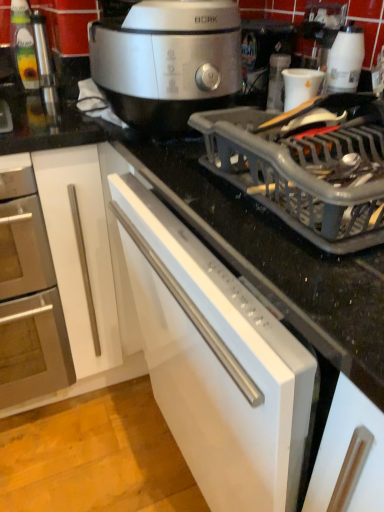
Question: From the image's perspective, would you say white glossy cup at upper right is positioned over satin silver slow cooker at upper center?

Choices:
 (A) no
 (B) yes

Answer: (A)

Question: Is white glossy cup at upper right oriented away from satin silver slow cooker at upper center?

Choices:
 (A) yes
 (B) no

Answer: (B)

Question: Does white glossy cup at upper right have a greater height compared to satin silver slow cooker at upper center?

Choices:
 (A) yes
 (B) no

Answer: (B)

Question: Can you confirm if white glossy cup at upper right is wider than satin silver slow cooker at upper center?

Choices:
 (A) no
 (B) yes

Answer: (A)

Question: From the image's perspective, does white glossy cup at upper right appear lower than satin silver slow cooker at upper center?

Choices:
 (A) no
 (B) yes

Answer: (B)

Question: In terms of width, does brushed metal oven at left look wider or thinner when compared to white matte dishwasher at center?

Choices:
 (A) wide
 (B) thin

Answer: (A)

Question: From a real-world perspective, relative to white matte dishwasher at center, is brushed metal oven at left vertically above or below?

Choices:
 (A) above
 (B) below

Answer: (B)

Question: Would you say brushed metal oven at left is to the left or to the right of white matte dishwasher at center in the picture?

Choices:
 (A) left
 (B) right

Answer: (A)

Question: From the image's perspective, is brushed metal oven at left positioned above or below white matte dishwasher at center?

Choices:
 (A) below
 (B) above

Answer: (B)

Question: Looking at the image, does white plastic coffee machine at upper right seem bigger or smaller compared to white glossy cup at upper right?

Choices:
 (A) big
 (B) small

Answer: (B)

Question: In the image, is white plastic coffee machine at upper right on the left side or the right side of white glossy cup at upper right?

Choices:
 (A) left
 (B) right

Answer: (A)

Question: In terms of height, does white plastic coffee machine at upper right look taller or shorter compared to white glossy cup at upper right?

Choices:
 (A) tall
 (B) short

Answer: (A)

Question: From the image's perspective, relative to white glossy cup at upper right, is white plastic coffee machine at upper right above or below?

Choices:
 (A) below
 (B) above

Answer: (B)

Question: In terms of width, does white matte dishwasher at center look wider or thinner when compared to brushed metal oven at left?

Choices:
 (A) thin
 (B) wide

Answer: (A)

Question: Is white matte dishwasher at center situated inside brushed metal oven at left or outside?

Choices:
 (A) inside
 (B) outside

Answer: (B)